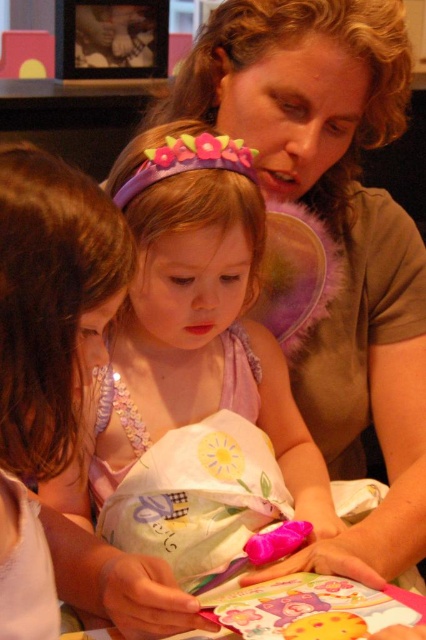
You are a photographer trying to capture a candid shot of the pink satin dress at center and the matte brown shirt at upper right. Since you want both subjects to be clearly visible in the photo, which one should you focus on first to ensure depth of field captures both?

The pink satin dress at center is in front of the matte brown shirt at upper right, so you should focus on the pink satin dress at center first to ensure both are in focus.

You are a photographer setting up a shoot in this scene. You need to place a light source above the pink satin dress at center so it illuminates the dress but doesn not shine on the matte brown shirt at upper right. Is this possible based on their positions?

The pink satin dress at center is positioned under the matte brown shirt at upper right, so placing a light source above the dress would naturally shine upwards towards the shirt. This means the light would also illuminate the matte brown shirt at upper right, making it difficult to avoid shining on it.